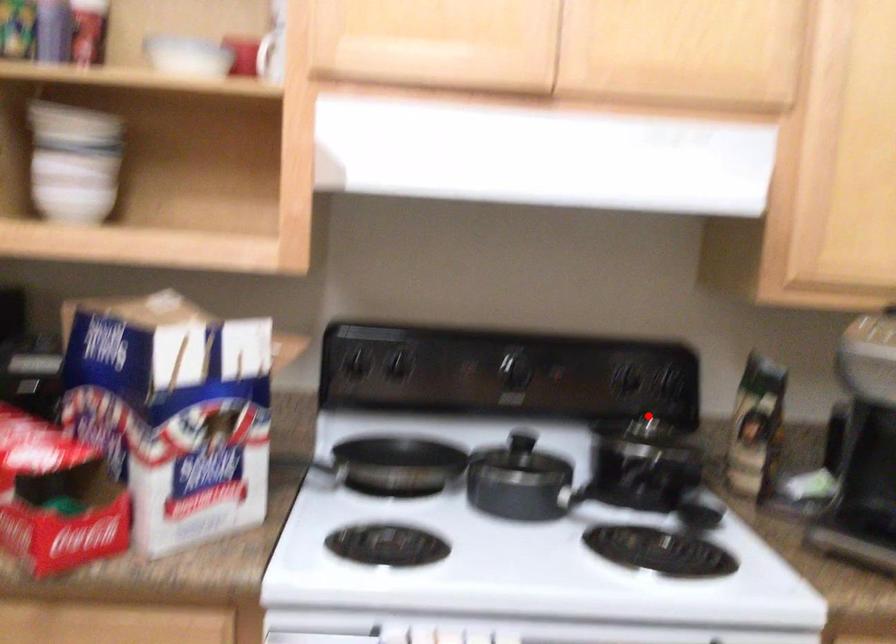
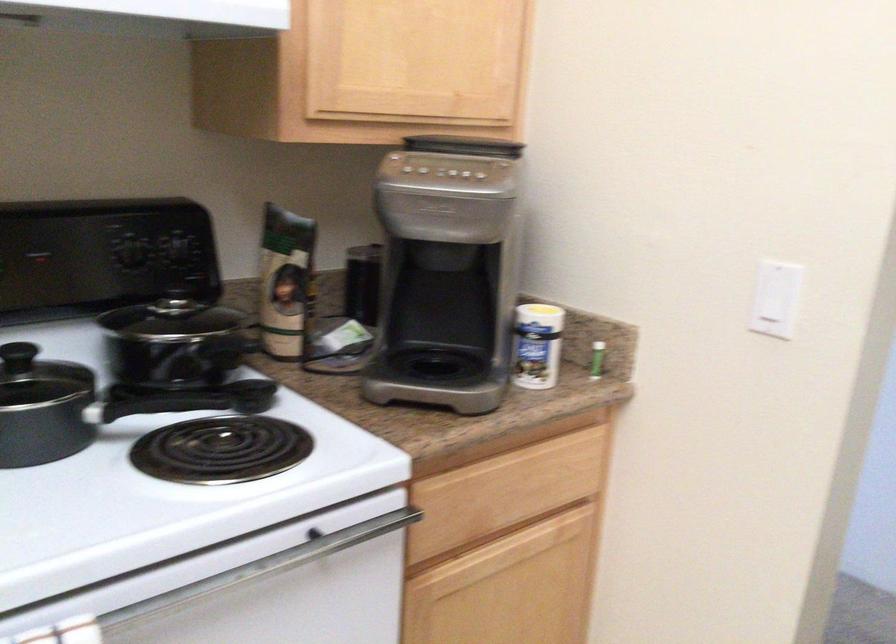
Question: I am providing you with two images of the same scene from different viewpoints. A red point is shown in image1. For the corresponding object point in image2, is it positioned nearer or farther from the camera?

Choices:
 (A) Nearer
 (B) Farther

Answer: (A)